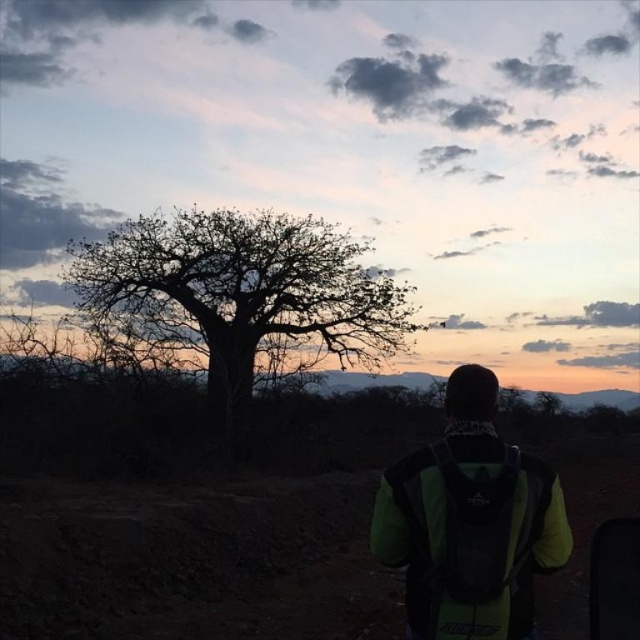
Measure the distance between point (188, 282) and camera.

A distance of 31.13 meters exists between point (188, 282) and camera.

Where is `silhouette wood tree at center`? The height and width of the screenshot is (640, 640). silhouette wood tree at center is located at coordinates (241, 296).

Is point (280, 256) closer to camera compared to point (412, 476)?

No.

This screenshot has height=640, width=640. I want to click on silhouette wood tree at center, so click(x=241, y=296).